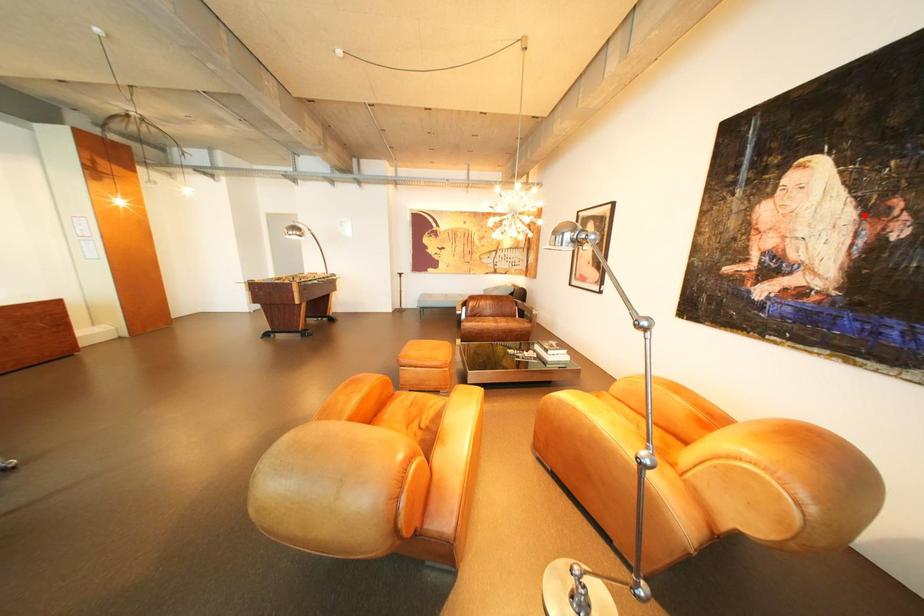
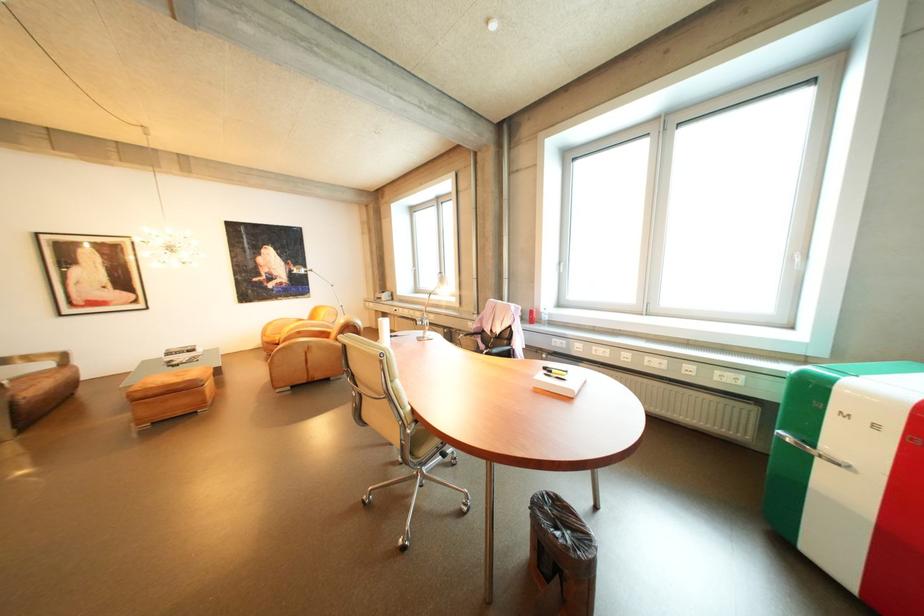
In the second image, find the point that corresponds to the highlighted location in the first image.

(296, 264)